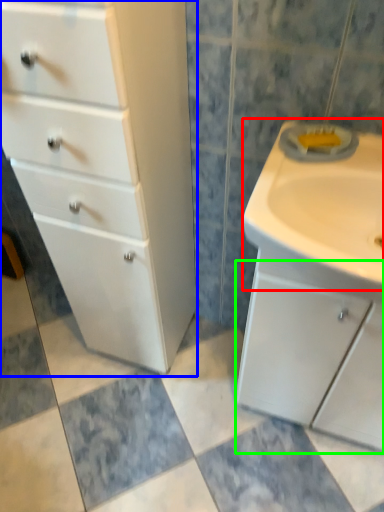
Question: Estimate the real-world distances between objects in this image. Which object is closer to sink (highlighted by a red box), chest of drawers (highlighted by a blue box) or cabinetry (highlighted by a green box)?

Choices:
 (A) chest of drawers
 (B) cabinetry

Answer: (B)